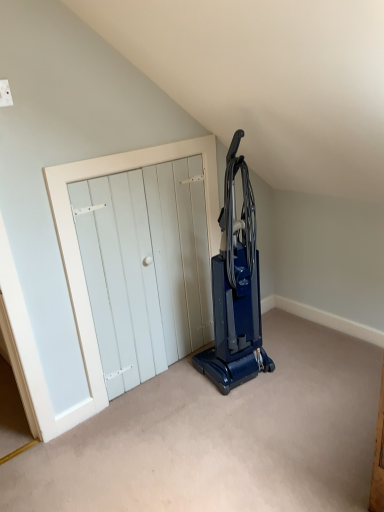
Locate an element on the screen. The height and width of the screenshot is (512, 384). free space to the left of blue plastic vacuum cleaner at center is located at coordinates (183, 384).